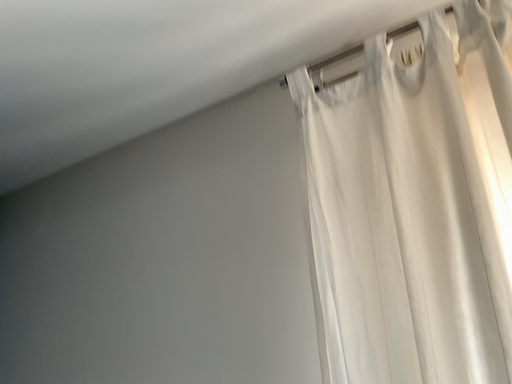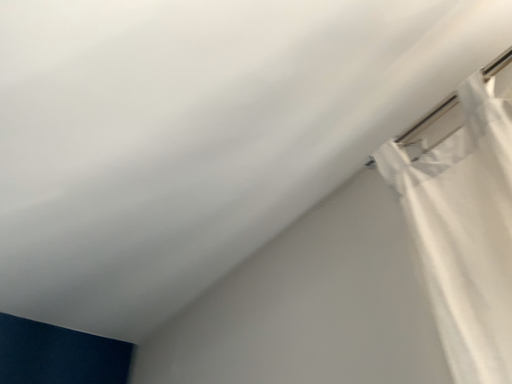
Question: How did the camera likely rotate when shooting the video?

Choices:
 (A) rotated downward
 (B) rotated upward

Answer: (B)